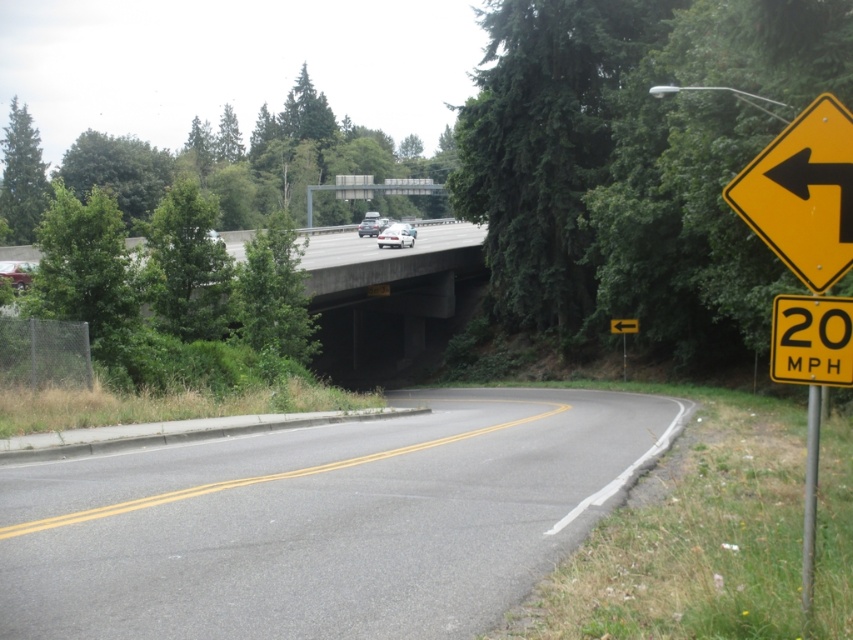
Question: Observing the image, what is the correct spatial positioning of gray asphalt road at center in reference to yellow metal signpost at right?

Choices:
 (A) below
 (B) above

Answer: (B)

Question: Which of these objects is positioned farthest from the gray asphalt road at center?

Choices:
 (A) white glossy sedan at center
 (B) white glossy sedan at upper center
 (C) yellow metallic speed limit sign at right

Answer: (A)

Question: Among these points, which one is farthest from the camera?

Choices:
 (A) (624, 337)
 (B) (523, 522)
 (C) (785, 182)
 (D) (811, 339)

Answer: (A)

Question: Is gray asphalt road at center positioned at the back of yellow plastic sign at right?

Choices:
 (A) no
 (B) yes

Answer: (B)

Question: Among these objects, which one is nearest to the camera?

Choices:
 (A) white glossy sedan at center
 (B) gray asphalt road at center
 (C) white glossy sedan at upper center
 (D) brushed metal car at left

Answer: (B)

Question: Is white glossy sedan at upper center bigger than white glossy sedan at center?

Choices:
 (A) no
 (B) yes

Answer: (B)